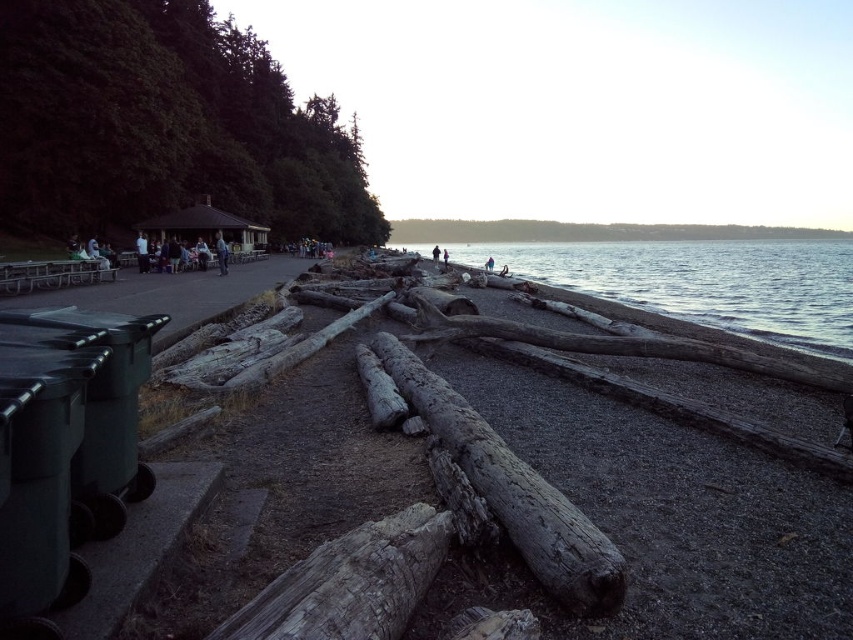
Between clear water at lower right and weathered wood log at lower center, which one is positioned lower?

weathered wood log at lower center

You are a GUI agent. You are given a task and a screenshot of the screen. Output one action in this format:
    pyautogui.click(x=<x>, y=<y>)
    Task: Click on the clear water at lower right
    This screenshot has width=853, height=640.
    Given the screenshot: What is the action you would take?
    pyautogui.click(x=703, y=282)

Is weathered wood log at center closer to the viewer compared to weathered wood log at lower center?

No, it is behind weathered wood log at lower center.

Is weathered wood log at center shorter than weathered wood log at lower center?

Incorrect, weathered wood log at center's height does not fall short of weathered wood log at lower center's.

This screenshot has width=853, height=640. Find the location of `weathered wood log at center`. weathered wood log at center is located at coordinates (512, 490).

Does clear water at lower right have a lesser height compared to weathered wood log at center?

No, clear water at lower right is not shorter than weathered wood log at center.

Find the location of a particular element. This screenshot has width=853, height=640. clear water at lower right is located at coordinates (703, 282).

Where is `clear water at lower right`? The height and width of the screenshot is (640, 853). clear water at lower right is located at coordinates (703, 282).